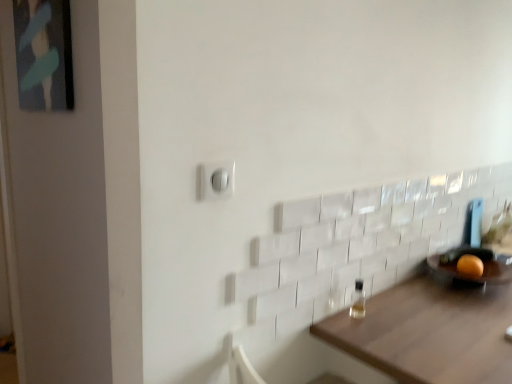
Identify the location of free space between transparent glass bottle at lower right and orange matte at right. The height and width of the screenshot is (384, 512). (422, 297).